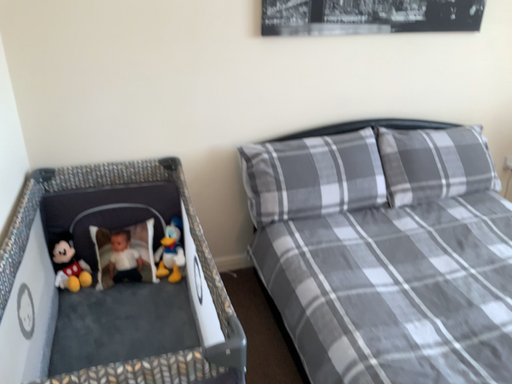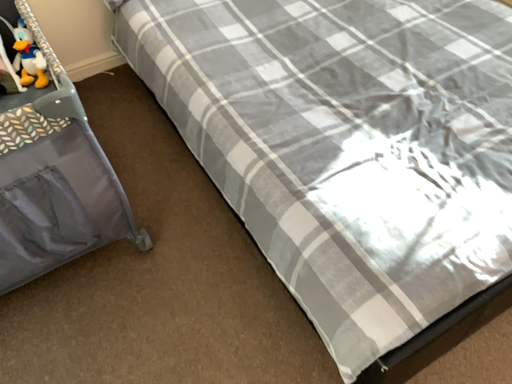
Question: Which way did the camera rotate in the video?

Choices:
 (A) rotated downward
 (B) rotated upward

Answer: (A)